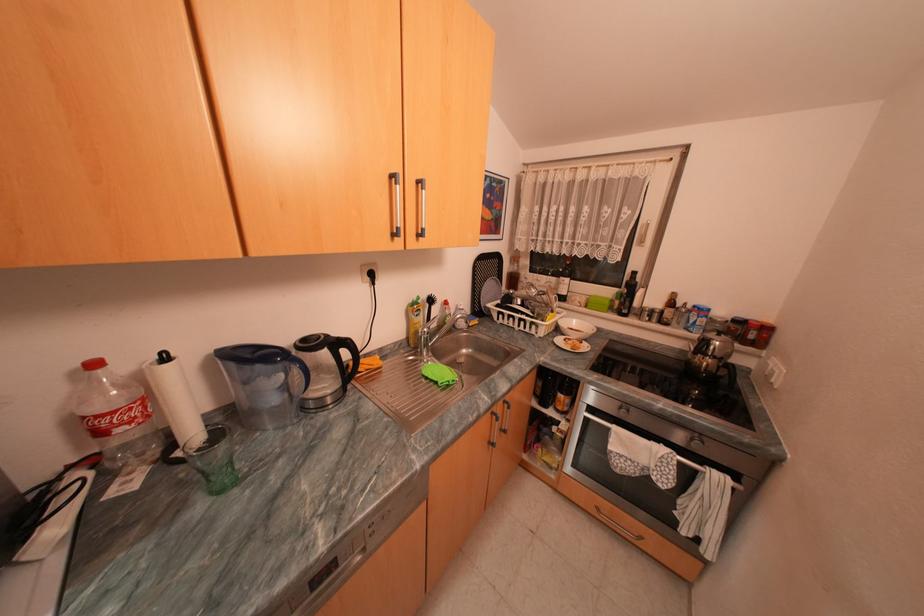
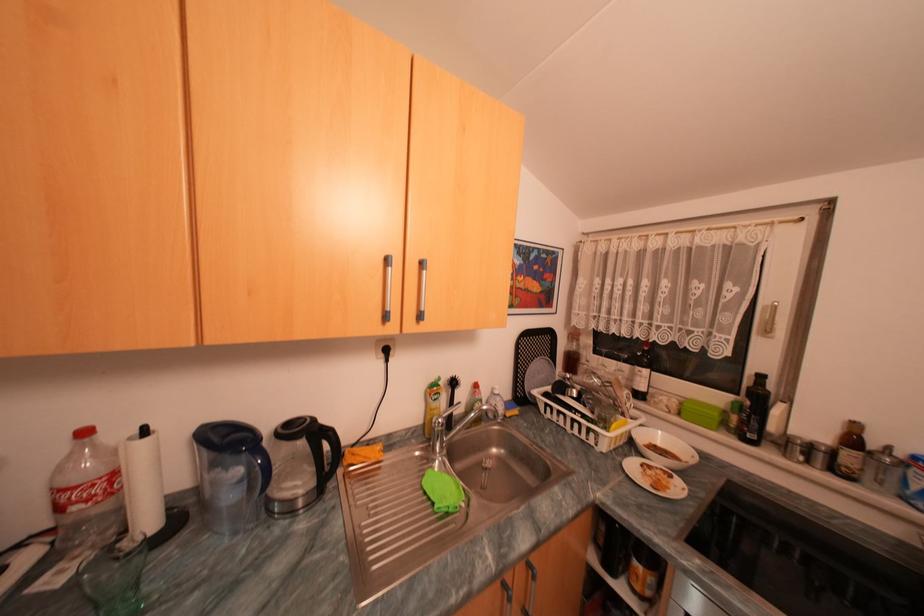
Find the pixel in the second image that matches (x=285, y=362) in the first image.

(249, 451)